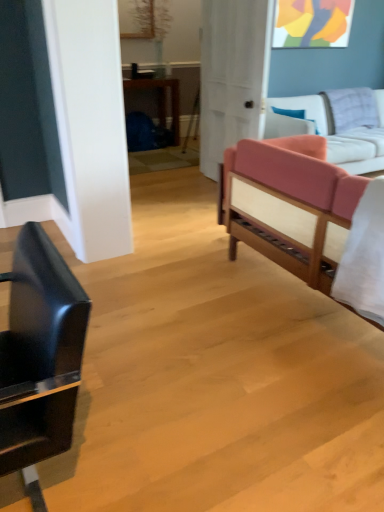
Question: Is pink fabric couch at right, the 1th studio couch when ordered from front to back, outside of shiny black chair at left?

Choices:
 (A) yes
 (B) no

Answer: (A)

Question: Does pink fabric couch at right, the 1th studio couch when ordered from front to back, come behind shiny black chair at left?

Choices:
 (A) no
 (B) yes

Answer: (B)

Question: From the image's perspective, is pink fabric couch at right, the second studio couch from the back, below shiny black chair at left?

Choices:
 (A) no
 (B) yes

Answer: (A)

Question: Is pink fabric couch at right, the 1th studio couch when ordered from front to back, beside shiny black chair at left?

Choices:
 (A) no
 (B) yes

Answer: (A)

Question: Is pink fabric couch at right, the second studio couch from the back, looking in the opposite direction of shiny black chair at left?

Choices:
 (A) no
 (B) yes

Answer: (B)

Question: From a real-world perspective, does pink fabric couch at right, the 1th studio couch when ordered from front to back, stand above shiny black chair at left?

Choices:
 (A) no
 (B) yes

Answer: (B)

Question: From the image's perspective, would you say white matte door at center is shown under white cotton sheet at right?

Choices:
 (A) no
 (B) yes

Answer: (A)

Question: Considering the relative sizes of white matte door at center and white cotton sheet at right in the image provided, is white matte door at center bigger than white cotton sheet at right?

Choices:
 (A) no
 (B) yes

Answer: (B)

Question: Is white matte door at center positioned in front of white cotton sheet at right?

Choices:
 (A) yes
 (B) no

Answer: (B)

Question: From the image's perspective, would you say white matte door at center is positioned over white cotton sheet at right?

Choices:
 (A) no
 (B) yes

Answer: (B)

Question: Does white matte door at center turn towards white cotton sheet at right?

Choices:
 (A) yes
 (B) no

Answer: (B)

Question: Does white matte door at center have a lesser width compared to white cotton sheet at right?

Choices:
 (A) no
 (B) yes

Answer: (B)

Question: Can you confirm if shiny black chair at left is bigger than pink fabric studio couch at right, placed as the 2th studio couch when sorted from front to back?

Choices:
 (A) no
 (B) yes

Answer: (A)